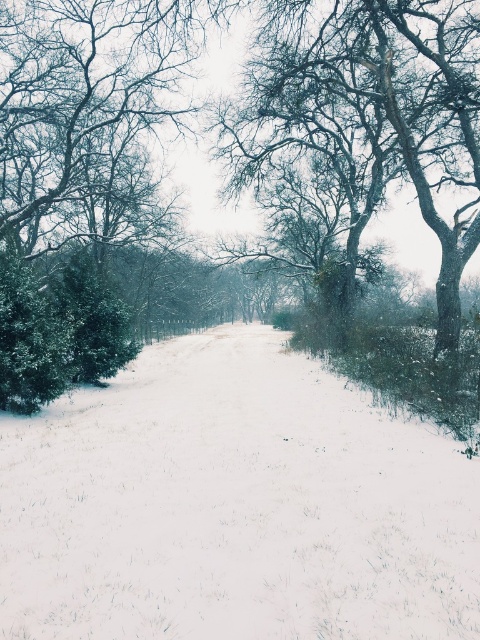
Question: Which point is closer to the camera?

Choices:
 (A) (36, 13)
 (B) (266, 492)

Answer: (B)

Question: Among these points, which one is farthest from the camera?

Choices:
 (A) (116, 432)
 (B) (352, 104)

Answer: (B)

Question: Does white snow at center appear over snow-covered tree at center?

Choices:
 (A) yes
 (B) no

Answer: (B)

Question: Can you confirm if white snow at center is positioned to the left of snow-covered tree at center?

Choices:
 (A) no
 (B) yes

Answer: (A)

Question: Considering the relative positions of white snow at center and snow-covered tree at center in the image provided, where is white snow at center located with respect to snow-covered tree at center?

Choices:
 (A) right
 (B) left

Answer: (A)